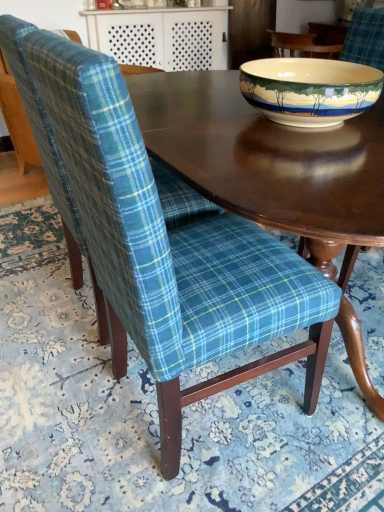
At what (x,y) coordinates should I click in order to perform the action: click on free location to the left of porcelain bowl at upper right. Please return your answer as a coordinate pair (x, y). The height and width of the screenshot is (512, 384). Looking at the image, I should click on (197, 133).